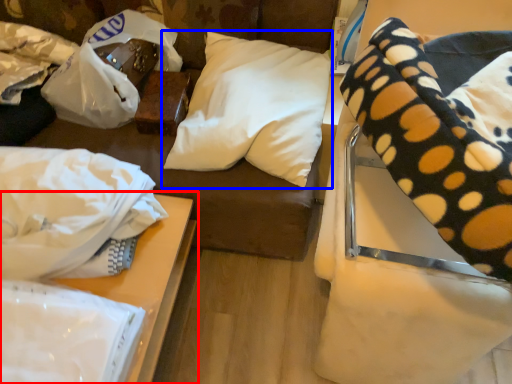
Question: Which object is further to the camera taking this photo, table (highlighted by a red box) or pillow (highlighted by a blue box)?

Choices:
 (A) table
 (B) pillow

Answer: (B)